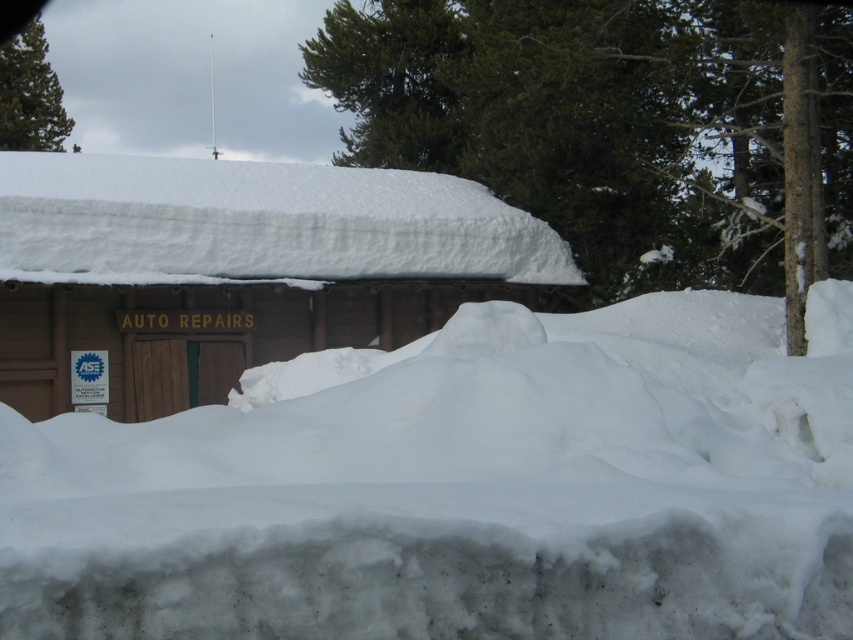
Question: Does wooden cabin at center lie behind green matte pine at upper left?

Choices:
 (A) yes
 (B) no

Answer: (B)

Question: Which object appears farthest from the camera in this image?

Choices:
 (A) white fluffy snow at center
 (B) green matte pine at upper left
 (C) wooden cabin at center

Answer: (B)

Question: In this image, where is white fluffy snow at center located relative to wooden cabin at center?

Choices:
 (A) left
 (B) right

Answer: (B)

Question: Where is white fluffy snow at center located in relation to wooden cabin at center in the image?

Choices:
 (A) below
 (B) above

Answer: (A)

Question: Which object is the closest to the white fluffy snow at center?

Choices:
 (A) green matte pine at upper left
 (B) wooden cabin at center

Answer: (B)

Question: Which object is positioned farthest from the white fluffy snow at center?

Choices:
 (A) green matte pine at upper left
 (B) wooden cabin at center

Answer: (A)